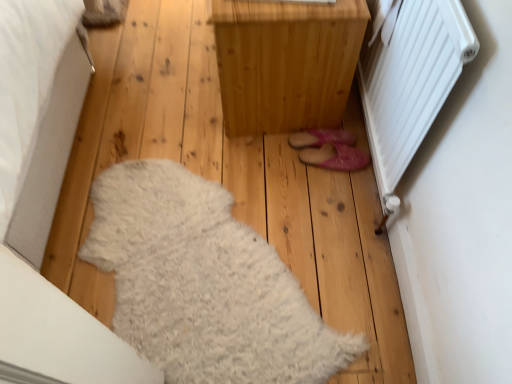
Question: Can you confirm if white fluffy rug at lower left is wider than natural wood cabinet at center?

Choices:
 (A) no
 (B) yes

Answer: (B)

Question: Is white fluffy rug at lower left to the right of natural wood cabinet at center from the viewer's perspective?

Choices:
 (A) yes
 (B) no

Answer: (B)

Question: Considering the relative sizes of white fluffy rug at lower left and natural wood cabinet at center in the image provided, is white fluffy rug at lower left taller than natural wood cabinet at center?

Choices:
 (A) no
 (B) yes

Answer: (A)

Question: Are white fluffy rug at lower left and natural wood cabinet at center making contact?

Choices:
 (A) no
 (B) yes

Answer: (A)

Question: Are white fluffy rug at lower left and natural wood cabinet at center located far from each other?

Choices:
 (A) no
 (B) yes

Answer: (A)

Question: Which is correct: pink fuzzy slippers at center is inside natural wood cabinet at center, or outside of it?

Choices:
 (A) inside
 (B) outside

Answer: (B)

Question: Considering their positions, is pink fuzzy slippers at center located in front of or behind natural wood cabinet at center?

Choices:
 (A) front
 (B) behind

Answer: (B)

Question: Is pink fuzzy slippers at center bigger or smaller than natural wood cabinet at center?

Choices:
 (A) small
 (B) big

Answer: (A)

Question: From the image's perspective, relative to natural wood cabinet at center, is pink fuzzy slippers at center above or below?

Choices:
 (A) below
 (B) above

Answer: (A)

Question: From the image's perspective, is natural wood cabinet at center above or below white fluffy rug at lower left?

Choices:
 (A) below
 (B) above

Answer: (B)

Question: Is point (317, 119) positioned closer to the camera than point (154, 170)?

Choices:
 (A) closer
 (B) farther

Answer: (B)

Question: In terms of size, does natural wood cabinet at center appear bigger or smaller than white fluffy rug at lower left?

Choices:
 (A) big
 (B) small

Answer: (A)

Question: Is natural wood cabinet at center in front of or behind white fluffy rug at lower left in the image?

Choices:
 (A) front
 (B) behind

Answer: (A)

Question: In terms of width, does natural wood cabinet at center look wider or thinner when compared to pink fuzzy slippers at center?

Choices:
 (A) thin
 (B) wide

Answer: (B)

Question: Does point (259, 112) appear closer or farther from the camera than point (342, 160)?

Choices:
 (A) farther
 (B) closer

Answer: (A)